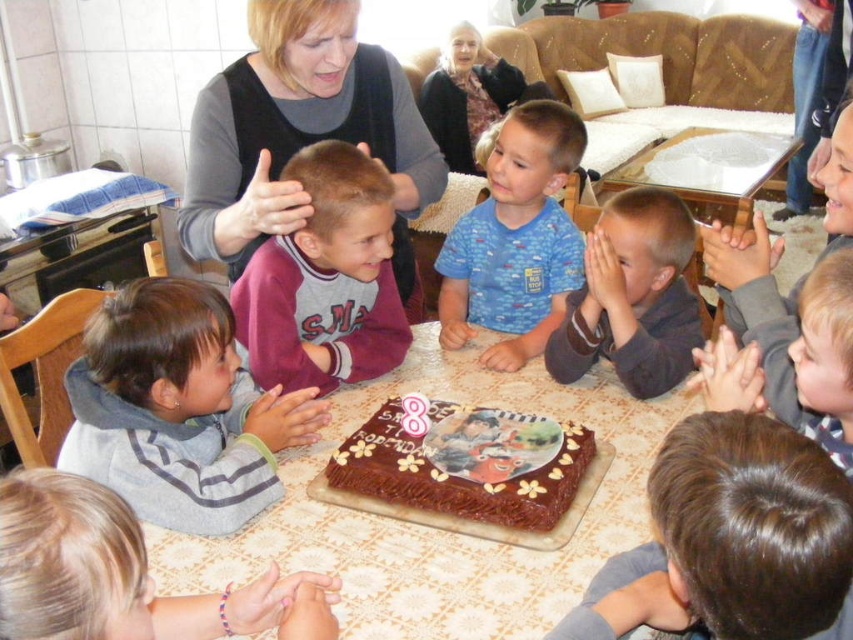
You are a photographer taking a picture of the birthday cake. You notice two points in the scene labeled as point (21, 595) and point (381, 456). Which point should you focus on to ensure the cake is in sharp focus?

You should focus on point (21, 595) because it is closer to the camera than point (381, 456), ensuring the cake is in sharp focus.

Consider the image. You are a child who wants to grab the chocolatesmoothcake at center to blow out the candles. You are currently holding the gray fleece sweater at lower left. Can you reach the cake without letting go of the sweater?

The distance between gray fleece sweater at lower left and chocolatesmoothcake at center is 15.46 inches. Since the child is holding the sweater, they would need to stretch their arm to reach the cake. Assuming an average arm length of about 24 inches for an 8 year old, the child can likely reach the cake while still holding the sweater.

You are a guest at the birthday party and want to place the gray fleece sweater at lower left and the chocolatesmoothcake at center on a shelf that can only hold items smaller than the sweater. Can both items fit on the shelf?

The gray fleece sweater at lower left is larger in size than the chocolatesmoothcake at center. Since the shelf can only hold items smaller than the sweater, the chocolatesmoothcake at center can fit, but the sweater cannot.